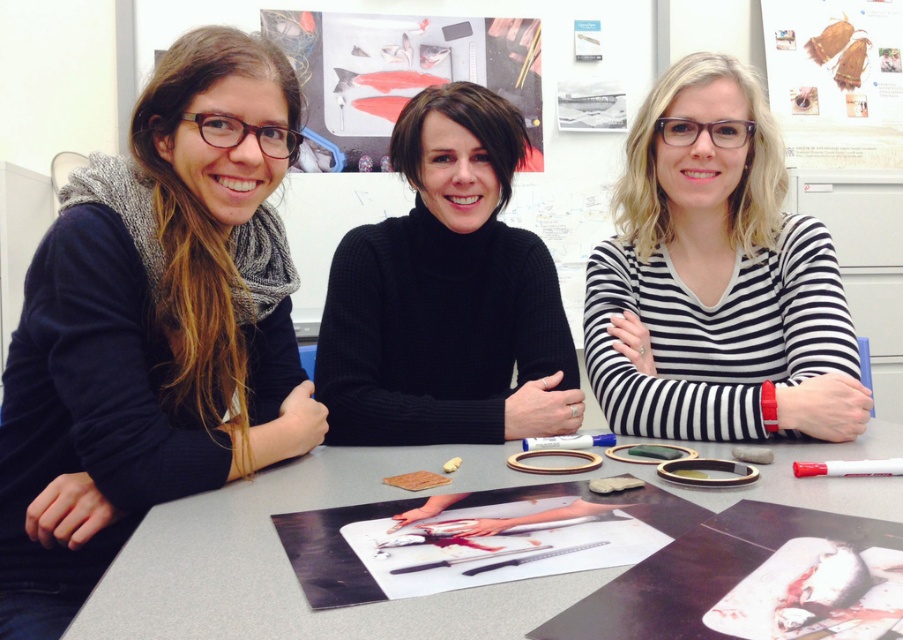
Is matte black sweater at left bigger than black turtleneck sweater at center?

Indeed, matte black sweater at left has a larger size compared to black turtleneck sweater at center.

Is point (73, 241) more distant than point (526, 432)?

No, (73, 241) is in front of (526, 432).

Find the location of `matte black sweater at left`. matte black sweater at left is located at coordinates (154, 326).

Looking at this image, is black turtleneck sweater at center positioned in front of smooth gray table at center?

No, black turtleneck sweater at center is behind smooth gray table at center.

Where is `black turtleneck sweater at center`? This screenshot has width=903, height=640. black turtleneck sweater at center is located at coordinates (447, 296).

The height and width of the screenshot is (640, 903). I want to click on black turtleneck sweater at center, so click(x=447, y=296).

Can you confirm if black and white striped shirt at center is smaller than smooth gray table at center?

Actually, black and white striped shirt at center might be larger than smooth gray table at center.

Is point (853, 337) less distant than point (881, 442)?

No.

Where is `black and white striped shirt at center`? The height and width of the screenshot is (640, 903). black and white striped shirt at center is located at coordinates (715, 278).